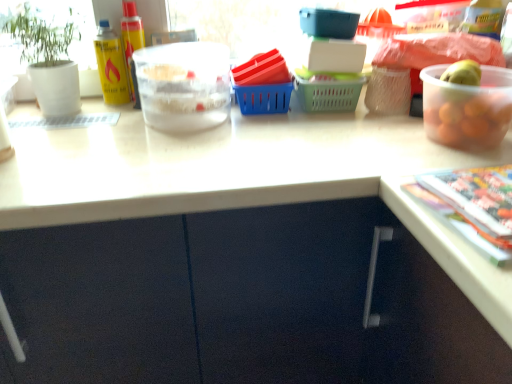
Where is `vacant area that is situated to the right of green matte plant pot at left`? vacant area that is situated to the right of green matte plant pot at left is located at coordinates (116, 118).